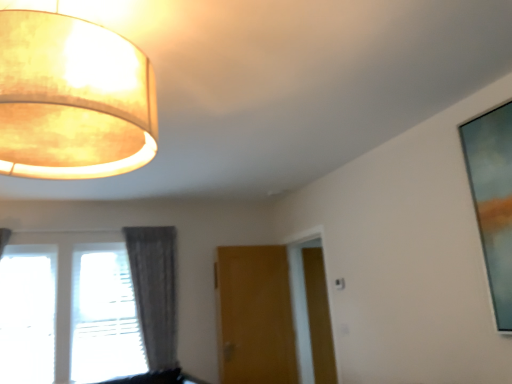
Question: From the image's perspective, is wooden door at center above or below glassy blue painting at upper right?

Choices:
 (A) above
 (B) below

Answer: (B)

Question: In the image, is wooden door at center positioned in front of or behind glassy blue painting at upper right?

Choices:
 (A) behind
 (B) front

Answer: (A)

Question: Which object is positioned farthest from the transparent glass window at lower left?

Choices:
 (A) brown wood screen door at center
 (B) gray fabric curtain at lower left
 (C) matte beige lampshade at upper left
 (D) wooden door at center
 (E) glassy blue painting at upper right

Answer: (E)

Question: Considering the real-world distances, which object is closest to the wooden door at center?

Choices:
 (A) matte beige lampshade at upper left
 (B) transparent glass window at lower left
 (C) brown wood screen door at center
 (D) glassy blue painting at upper right
 (E) gray fabric curtain at lower left

Answer: (C)